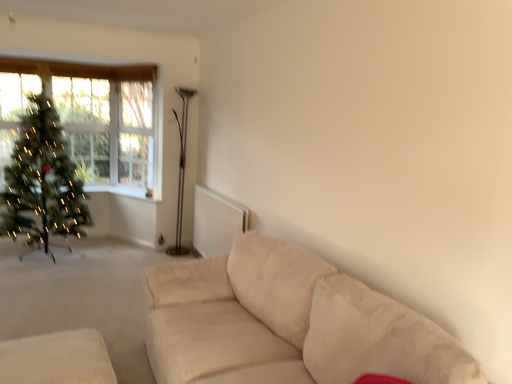
In order to face metallic silver floor lamp at center, should I rotate leftwards or rightwards?

You should look left and rotate roughly 9.533 degrees.

What do you see at coordinates (136, 135) in the screenshot? I see `clear glass window at upper left` at bounding box center [136, 135].

You are a GUI agent. You are given a task and a screenshot of the screen. Output one action in this format:
    pyautogui.click(x=<x>, y=<y>)
    Task: Click on the metallic silver floor lamp at center
    Image resolution: width=512 pixels, height=384 pixels.
    Given the screenshot: What is the action you would take?
    pyautogui.click(x=181, y=169)

Which of these two, metallic silver floor lamp at center or green matte christmas tree at left, is smaller?

metallic silver floor lamp at center.

Which point is more distant from viewer, (x=183, y=92) or (x=32, y=240)?

The point (x=183, y=92) is more distant.

Considering the relative sizes of metallic silver floor lamp at center and green matte christmas tree at left in the image provided, is metallic silver floor lamp at center shorter than green matte christmas tree at left?

In fact, metallic silver floor lamp at center may be taller than green matte christmas tree at left.

From a real-world perspective, between clear glass window at upper left and metallic silver floor lamp at center, who is vertically higher?

clear glass window at upper left is physically above.

Which of these two, clear glass window at upper left or metallic silver floor lamp at center, is bigger?

With larger size is metallic silver floor lamp at center.

From the image's perspective, which is below, clear glass window at upper left or metallic silver floor lamp at center?

metallic silver floor lamp at center appears lower in the image.

Looking at this image, is clear glass window at upper left inside the boundaries of metallic silver floor lamp at center, or outside?

clear glass window at upper left is outside metallic silver floor lamp at center.

Is metallic silver floor lamp at center spatially inside clear glass window at upper left, or outside of it?

metallic silver floor lamp at center cannot be found inside clear glass window at upper left.

Considering the sizes of objects metallic silver floor lamp at center and clear glass window at upper left in the image provided, who is taller, metallic silver floor lamp at center or clear glass window at upper left?

With more height is metallic silver floor lamp at center.

The image size is (512, 384). Find the location of `window screen behind the metallic silver floor lamp at center`. window screen behind the metallic silver floor lamp at center is located at coordinates (136, 135).

Considering the sizes of objects metallic silver floor lamp at center and clear glass window at upper left in the image provided, who is wider, metallic silver floor lamp at center or clear glass window at upper left?

metallic silver floor lamp at center is wider.

Between green matte christmas tree at left and beige fabric ottoman at lower left, which one has larger width?

With larger width is green matte christmas tree at left.

Considering the relative positions of green matte christmas tree at left and beige fabric ottoman at lower left in the image provided, is green matte christmas tree at left to the right of beige fabric ottoman at lower left from the viewer's perspective?

No.

What are the coordinates of `christmas tree in front of the clear glass window at upper left` in the screenshot? It's located at (42, 182).

Is clear glass window at upper left far from green matte christmas tree at left?

Yes, clear glass window at upper left and green matte christmas tree at left are quite far apart.

In the scene shown: From a real-world perspective, which is physically below, clear glass window at upper left or green matte christmas tree at left?

green matte christmas tree at left.

Which is more to the left, clear glass window at upper left or green matte christmas tree at left?

green matte christmas tree at left.

From their relative heights in the image, would you say beige fabric ottoman at lower left is taller or shorter than green matte christmas tree at left?

Clearly, beige fabric ottoman at lower left is shorter compared to green matte christmas tree at left.

Where is `furniture that appears below the green matte christmas tree at left (from the image's perspective)`? furniture that appears below the green matte christmas tree at left (from the image's perspective) is located at coordinates (57, 359).

From a real-world perspective, which is physically below, beige fabric ottoman at lower left or green matte christmas tree at left?

beige fabric ottoman at lower left, from a real-world perspective.

Is beige fabric ottoman at lower left positioned with its back to green matte christmas tree at left?

beige fabric ottoman at lower left is not turned away from green matte christmas tree at left.

From the image's perspective, is green matte christmas tree at left over metallic silver floor lamp at center?

Yes, from the image's perspective, green matte christmas tree at left is over metallic silver floor lamp at center.

Is point (51, 102) farther from camera compared to point (181, 89)?

Yes, point (51, 102) is behind point (181, 89).

Is green matte christmas tree at left situated inside metallic silver floor lamp at center or outside?

green matte christmas tree at left is outside metallic silver floor lamp at center.

Can you tell me how much green matte christmas tree at left and metallic silver floor lamp at center differ in facing direction?

The angle between the facing direction of green matte christmas tree at left and the facing direction of metallic silver floor lamp at center is 89.6 degrees.

The width and height of the screenshot is (512, 384). Identify the location of christmas tree in front of the metallic silver floor lamp at center. (42, 182).

This screenshot has width=512, height=384. What are the coordinates of `window screen positioned vertically above the metallic silver floor lamp at center (from a real-world perspective)` in the screenshot? It's located at (136, 135).

Looking at this image, which object lies further to the anchor point green matte christmas tree at left, beige fabric ottoman at lower left or metallic silver floor lamp at center?

A: Based on the image, beige fabric ottoman at lower left appears to be further to green matte christmas tree at left.

Based on their spatial positions, is clear glass window at upper left or beige fabric ottoman at lower left closer to metallic silver floor lamp at center?

clear glass window at upper left is closer to metallic silver floor lamp at center.

Considering their positions, is green matte christmas tree at left positioned further to beige fabric ottoman at lower left than clear glass window at upper left?

The object further to beige fabric ottoman at lower left is clear glass window at upper left.

From the image, which object appears to be farther from green matte christmas tree at left, clear glass window at upper left or beige fabric ottoman at lower left?

beige fabric ottoman at lower left is positioned further to the anchor green matte christmas tree at left.

Which object lies further to the anchor point clear glass window at upper left, metallic silver floor lamp at center or beige fabric ottoman at lower left?

beige fabric ottoman at lower left lies further to clear glass window at upper left than the other object.

Based on their spatial positions, is beige fabric ottoman at lower left or metallic silver floor lamp at center further from clear glass window at upper left?

beige fabric ottoman at lower left lies further to clear glass window at upper left than the other object.

When comparing their distances from metallic silver floor lamp at center, does beige fabric ottoman at lower left or clear glass window at upper left seem closer?

The object closer to metallic silver floor lamp at center is clear glass window at upper left.

From the image, which object appears to be nearer to clear glass window at upper left, beige fabric ottoman at lower left or green matte christmas tree at left?

Based on the image, green matte christmas tree at left appears to be nearer to clear glass window at upper left.

Locate an element on the screen. The width and height of the screenshot is (512, 384). christmas tree between beige fabric ottoman at lower left and metallic silver floor lamp at center from front to back is located at coordinates click(42, 182).

The image size is (512, 384). In order to click on window screen located between green matte christmas tree at left and metallic silver floor lamp at center in the left-right direction in this screenshot , I will do `click(136, 135)`.

What are the coordinates of `lamp between beige fabric ottoman at lower left and clear glass window at upper left in the front-back direction` in the screenshot? It's located at (181, 169).

Locate an element on the screen. This screenshot has height=384, width=512. christmas tree between beige fabric ottoman at lower left and clear glass window at upper left along the z-axis is located at coordinates (42, 182).